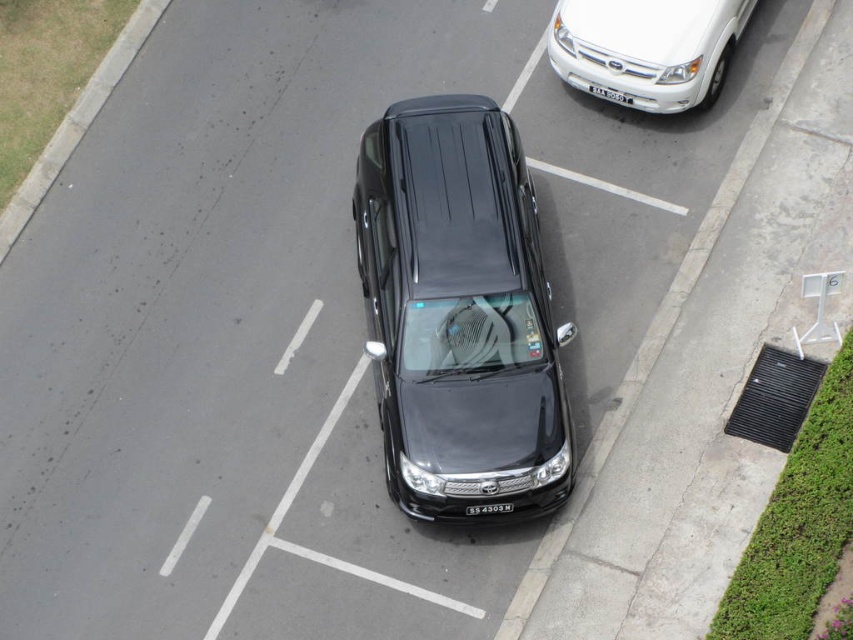
Is black glossy sedan at center below white plastic license plate at center?

Yes.

The height and width of the screenshot is (640, 853). What are the coordinates of `black glossy sedan at center` in the screenshot? It's located at (459, 310).

Identify the location of black glossy sedan at center. This screenshot has width=853, height=640. (459, 310).

Can you confirm if black metal grate at lower right is positioned to the left of white plastic license plate at center?

In fact, black metal grate at lower right is to the right of white plastic license plate at center.

Is black metal grate at lower right further to the viewer compared to white plastic license plate at center?

No, black metal grate at lower right is in front of white plastic license plate at center.

I want to click on black metal grate at lower right, so click(x=775, y=397).

Can you confirm if black metal grate at lower right is positioned to the right of black plastic license plate at center?

Indeed, black metal grate at lower right is positioned on the right side of black plastic license plate at center.

Between black metal grate at lower right and black plastic license plate at center, which one is positioned lower?

black plastic license plate at center is lower down.

This screenshot has height=640, width=853. I want to click on black metal grate at lower right, so coord(775,397).